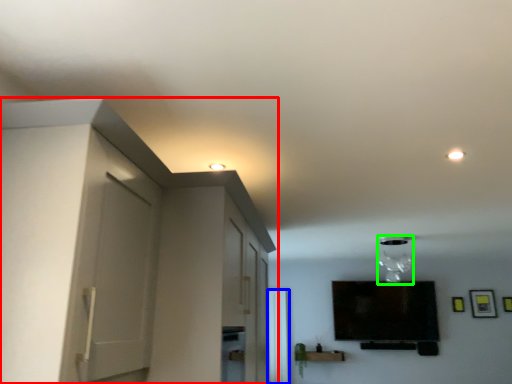
Question: Based on their relative distances, which object is nearer to dresser (highlighted by a red box)? Choose from window (highlighted by a blue box) and light fixture (highlighted by a green box).

Choices:
 (A) window
 (B) light fixture

Answer: (B)